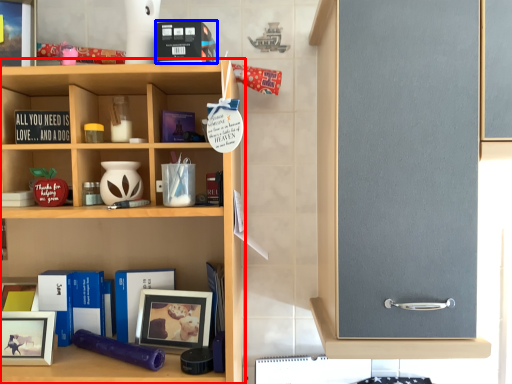
Question: Which object appears closest to the camera in this image, shelf (highlighted by a red box) or book (highlighted by a blue box)?

Choices:
 (A) shelf
 (B) book

Answer: (B)